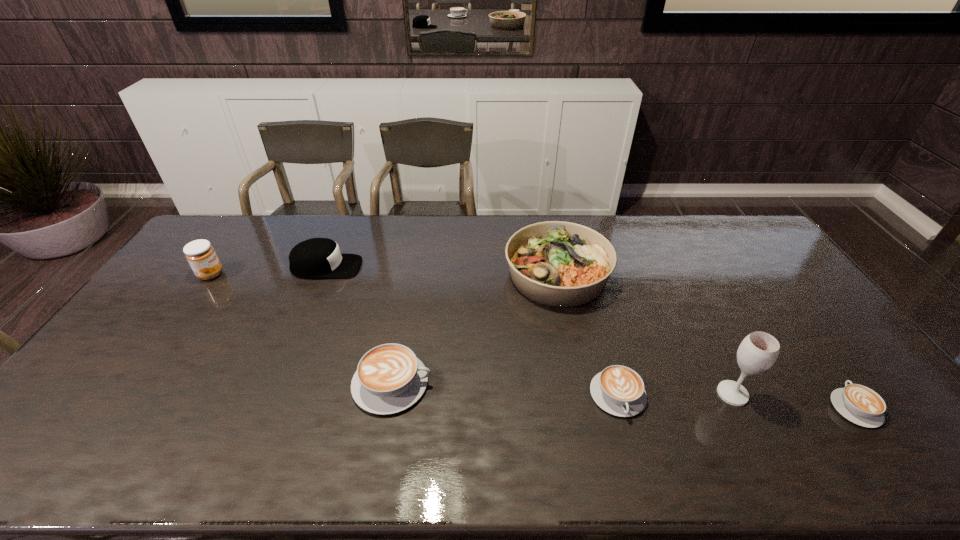
Locate an element on the screen. wineglass that is at the near edge is located at coordinates (758, 351).

At what (x,y) coordinates should I click in order to perform the action: click on object situated at the left edge. Please return your answer as a coordinate pair (x, y). The height and width of the screenshot is (540, 960). Looking at the image, I should click on (201, 256).

Image resolution: width=960 pixels, height=540 pixels. What are the coordinates of `object that is at the right edge` in the screenshot? It's located at (859, 404).

This screenshot has height=540, width=960. What are the coordinates of `object located at the near right corner` in the screenshot? It's located at (859, 404).

I want to click on vacant space at the far edge of the desktop, so click(368, 217).

The height and width of the screenshot is (540, 960). I want to click on free location at the near edge, so (536, 406).

Where is `vacant space at the left edge of the desktop`? This screenshot has height=540, width=960. vacant space at the left edge of the desktop is located at coordinates (197, 300).

Locate an element on the screen. The image size is (960, 540). vacant space at the right edge of the desktop is located at coordinates point(747,272).

Locate an element on the screen. The height and width of the screenshot is (540, 960). vacant space at the far left corner of the desktop is located at coordinates (237, 225).

The width and height of the screenshot is (960, 540). In the image, there is a desktop. Identify the location of vacant space at the far right corner. (754, 242).